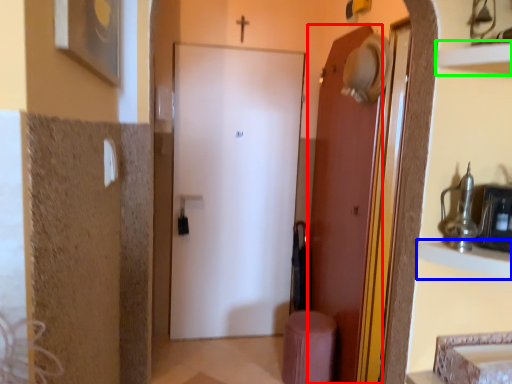
Question: Estimate the real-world distances between objects in this image. Which object is closer to door (highlighted by a red box), cabinet (highlighted by a blue box) or shelf (highlighted by a green box)?

Choices:
 (A) cabinet
 (B) shelf

Answer: (A)